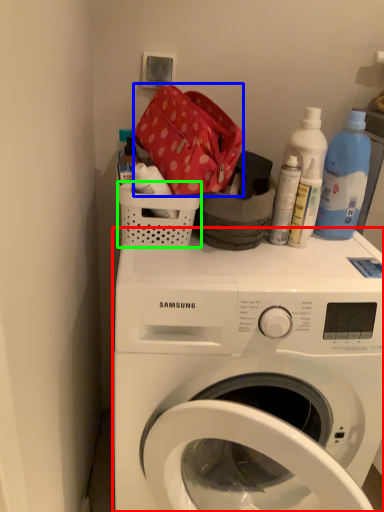
Question: Based on their relative distances, which object is farther from washing machine (highlighted by a red box)? Choose from material (highlighted by a blue box) and basket (highlighted by a green box).

Choices:
 (A) material
 (B) basket

Answer: (A)